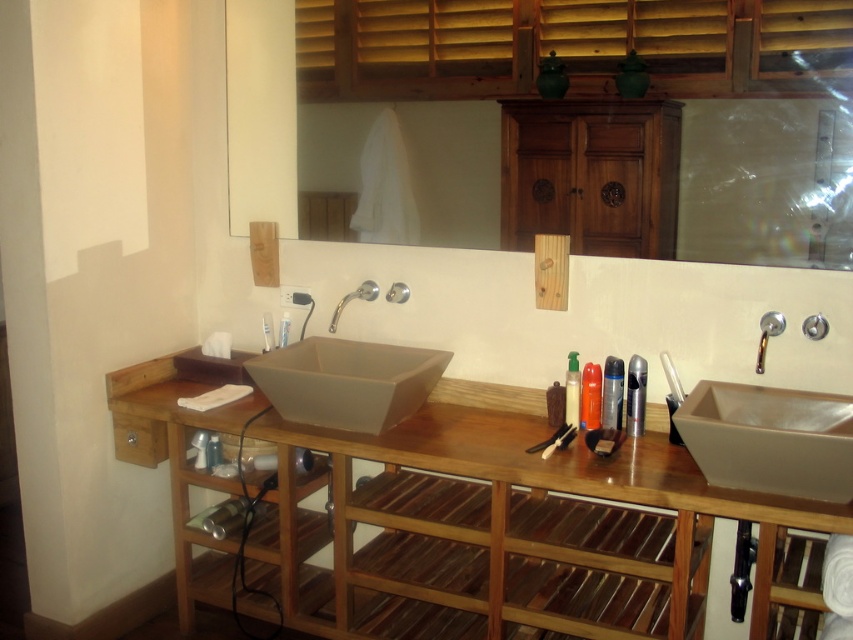
Is wooden vanity at center closer to camera compared to silver metallic faucet at center?

That is True.

Which is more to the right, wooden vanity at center or silver metallic faucet at center?

Positioned to the right is wooden vanity at center.

Who is more distant from viewer, (366, 616) or (335, 328)?

Point (335, 328)

At what (x,y) coordinates should I click in order to perform the action: click on wooden vanity at center. Please return your answer as a coordinate pair (x, y). Image resolution: width=853 pixels, height=640 pixels. Looking at the image, I should click on (454, 518).

Is silver metallic faucet at center thinner than wooden comb at center?

In fact, silver metallic faucet at center might be wider than wooden comb at center.

Is silver metallic faucet at center smaller than wooden comb at center?

No, silver metallic faucet at center is not smaller than wooden comb at center.

Between point (357, 292) and point (543, 456), which one is positioned in front?

Point (543, 456) is more forward.

You are a GUI agent. You are given a task and a screenshot of the screen. Output one action in this format:
    pyautogui.click(x=<x>, y=<y>)
    Task: Click on the silver metallic faucet at center
    Image resolution: width=853 pixels, height=640 pixels.
    Given the screenshot: What is the action you would take?
    pyautogui.click(x=352, y=298)

Is matte beige sink at center bigger than silver metallic faucet at upper right?

Yes, matte beige sink at center is bigger than silver metallic faucet at upper right.

The height and width of the screenshot is (640, 853). What do you see at coordinates (347, 381) in the screenshot? I see `matte beige sink at center` at bounding box center [347, 381].

Between point (317, 346) and point (773, 317), which one is positioned behind?

Point (317, 346)

Where is `matte beige sink at center`? matte beige sink at center is located at coordinates (347, 381).